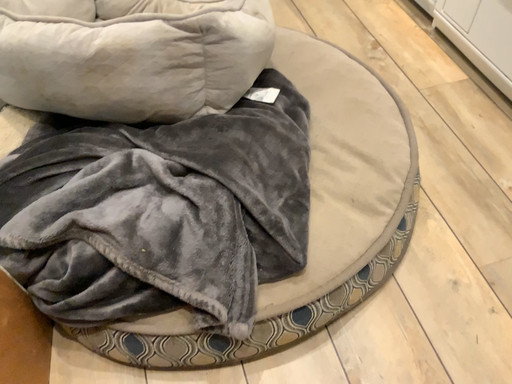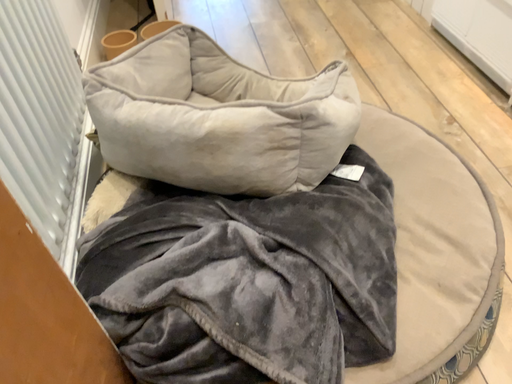
Question: Which way did the camera rotate in the video?

Choices:
 (A) rotated upward
 (B) rotated downward

Answer: (A)